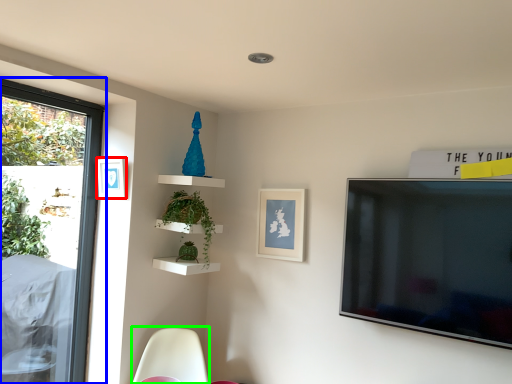
Question: Based on their relative distances, which object is nearer to picture frame (highlighted by a red box)? Choose from window (highlighted by a blue box) and swivel chair (highlighted by a green box).

Choices:
 (A) window
 (B) swivel chair

Answer: (A)